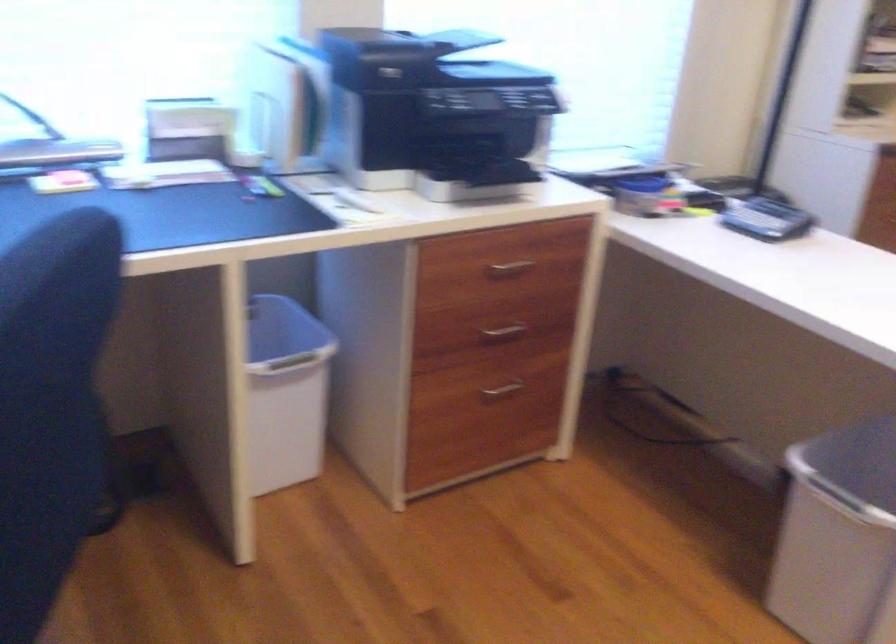
Find the location of a particular element. The image size is (896, 644). silver trash can lid is located at coordinates (851, 467).